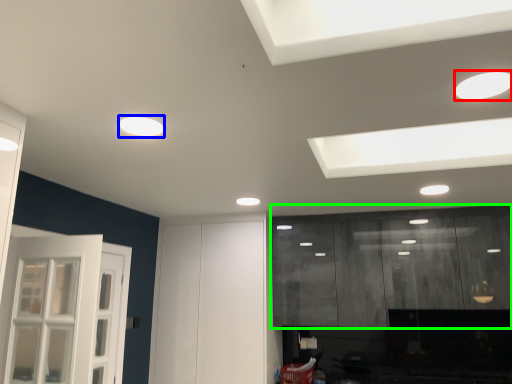
Question: Considering the real-world distances, which object is closest to lighting (highlighted by a red box)? lighting (highlighted by a blue box) or cabinetry (highlighted by a green box).

Choices:
 (A) lighting
 (B) cabinetry

Answer: (A)